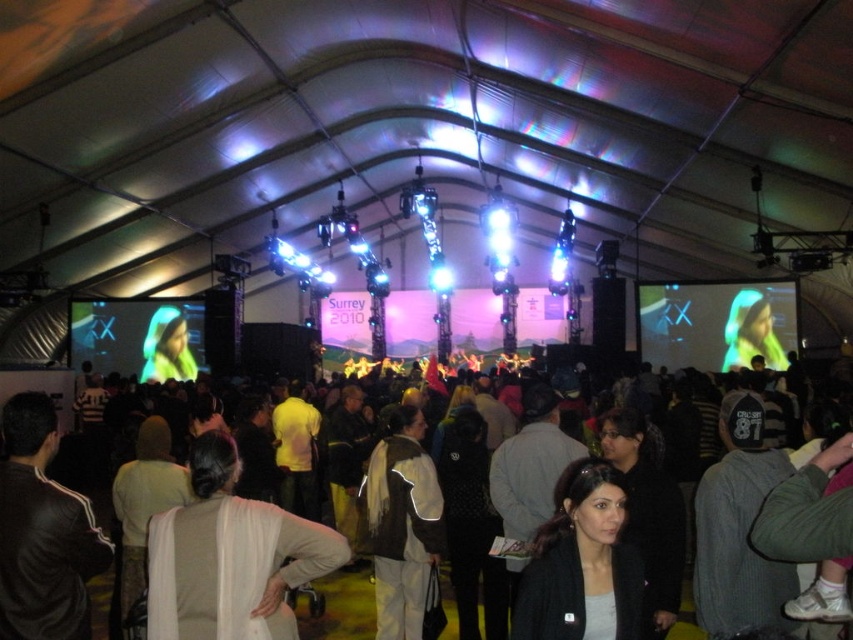
Can you confirm if black mesh dress at center is wider than matte black jacket at center?

Yes.

Which is in front, point (490, 524) or point (631, 500)?

Point (631, 500) is in front.

This screenshot has height=640, width=853. What do you see at coordinates (469, 524) in the screenshot?
I see `black mesh dress at center` at bounding box center [469, 524].

The width and height of the screenshot is (853, 640). I want to click on black mesh dress at center, so click(469, 524).

Between beige fabric jacket at center and matte black jacket at lower center, which one is positioned lower?

matte black jacket at lower center is below.

Who is shorter, beige fabric jacket at center or matte black jacket at lower center?

With less height is matte black jacket at lower center.

What do you see at coordinates (230, 556) in the screenshot? Image resolution: width=853 pixels, height=640 pixels. I see `beige fabric jacket at center` at bounding box center [230, 556].

You are a GUI agent. You are given a task and a screenshot of the screen. Output one action in this format:
    pyautogui.click(x=<x>, y=<y>)
    Task: Click on the beige fabric jacket at center
    This screenshot has width=853, height=640.
    Given the screenshot: What is the action you would take?
    pyautogui.click(x=230, y=556)

Is matte black jacket at lower center positioned before dark clothing crowd at center?

No, it is behind dark clothing crowd at center.

Which is above, matte black jacket at lower center or dark clothing crowd at center?

matte black jacket at lower center is higher up.

What do you see at coordinates (583, 564) in the screenshot? The width and height of the screenshot is (853, 640). I see `matte black jacket at lower center` at bounding box center [583, 564].

This screenshot has width=853, height=640. Identify the location of matte black jacket at lower center. (583, 564).